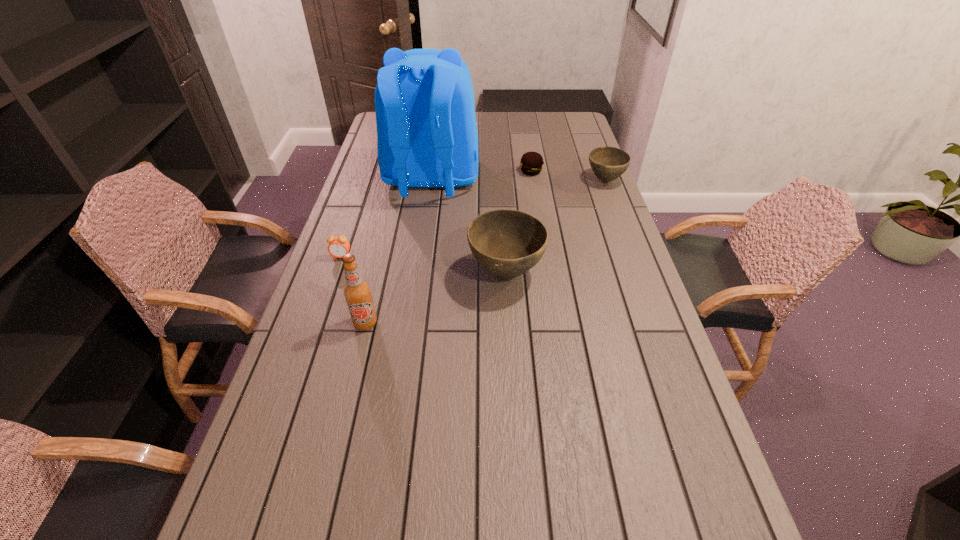
Please point a spot on the left to add another bowl. Please provide its 2D coordinates. Your answer should be formatted as a tuple, i.e. [(x, y)], where the tuple contains the x and y coordinates of a point satisfying the conditions above.

[(329, 438)]